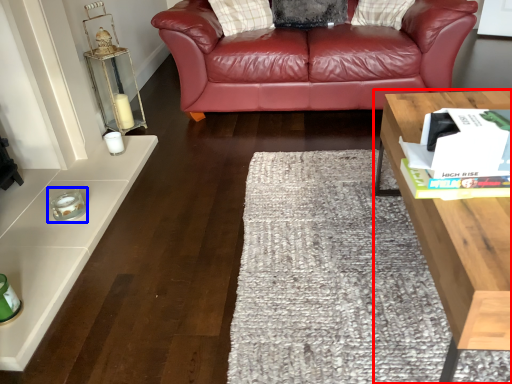
Question: Which object is further to the camera taking this photo, table (highlighted by a red box) or candle holder (highlighted by a blue box)?

Choices:
 (A) table
 (B) candle holder

Answer: (B)